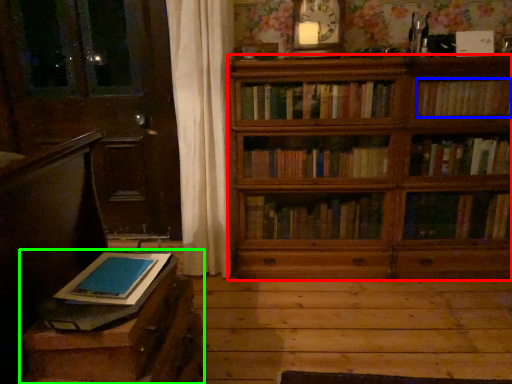
Question: Which object is the farthest from bookcase (highlighted by a red box)? Choose among these: book (highlighted by a blue box) or table (highlighted by a green box).

Choices:
 (A) book
 (B) table

Answer: (B)